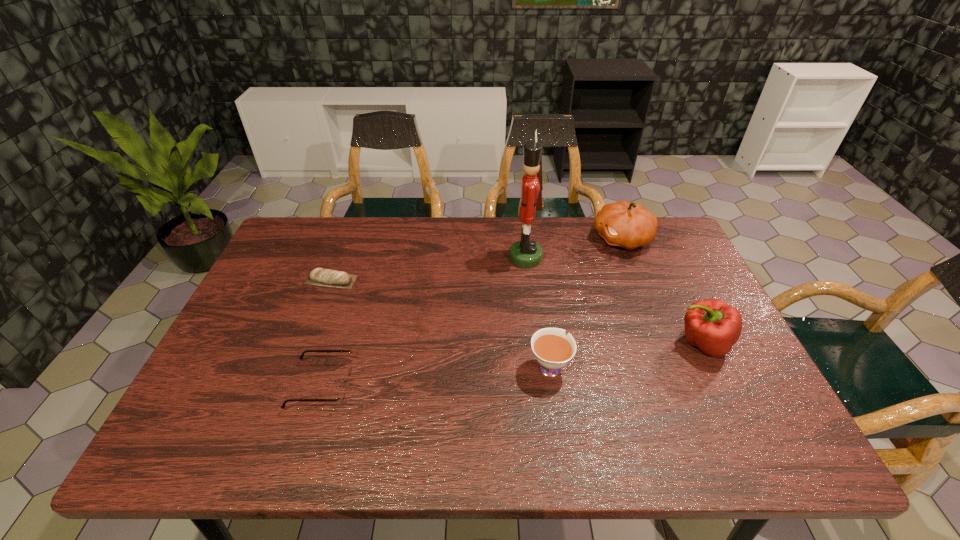
I want to click on free spot located 0.270m on the front face of the fifth shortest object, so (509, 239).

Where is `free space located 0.120m on the front face of the fifth shortest object`? The image size is (960, 540). free space located 0.120m on the front face of the fifth shortest object is located at coordinates (554, 239).

Where is `blank space located on the front face of the fifth shortest object`? This screenshot has width=960, height=540. blank space located on the front face of the fifth shortest object is located at coordinates (472, 239).

You are a GUI agent. You are given a task and a screenshot of the screen. Output one action in this format:
    pyautogui.click(x=<x>, y=<y>)
    Task: Click on the blank area located 0.220m on the back of the third tallest object
    This screenshot has width=960, height=540.
    Given the screenshot: What is the action you would take?
    pyautogui.click(x=667, y=269)

The height and width of the screenshot is (540, 960). What are the coordinates of `free spot located on the side of the teacup with the handle` in the screenshot? It's located at pos(533,252).

In order to click on blank space located 0.380m on the side of the teacup with the handle in this screenshot , I will do `click(533, 252)`.

Find the location of a particular element. The width and height of the screenshot is (960, 540). free space located 0.060m on the side of the teacup with the handle is located at coordinates (544, 328).

Image resolution: width=960 pixels, height=540 pixels. Find the location of `vacant space located at the hinge ends of the second shortest object`. vacant space located at the hinge ends of the second shortest object is located at coordinates (391, 384).

The image size is (960, 540). Find the location of `free point located on the right of the shortest object`. free point located on the right of the shortest object is located at coordinates (380, 280).

Identify the location of nutcracker that is positioned at the far edge. Image resolution: width=960 pixels, height=540 pixels. (525, 253).